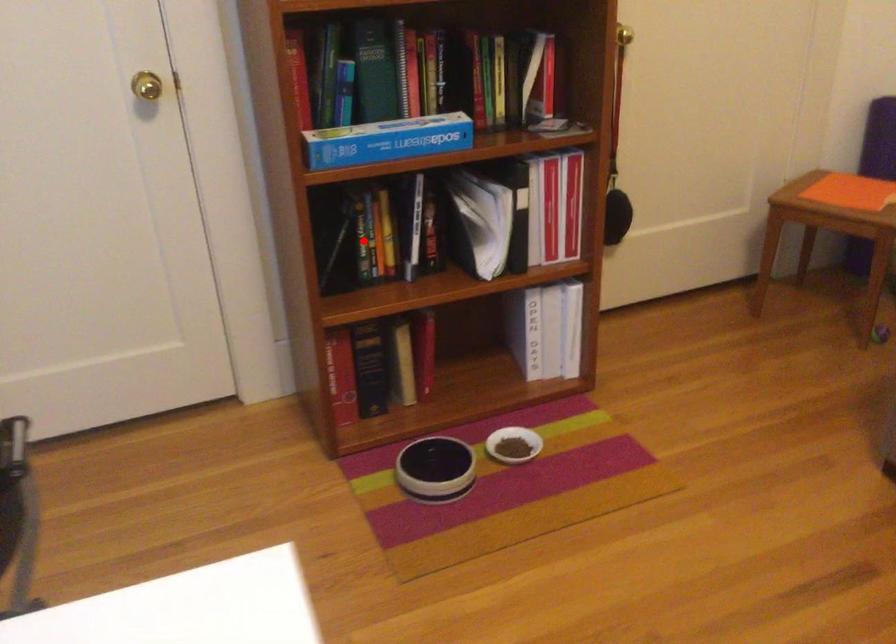
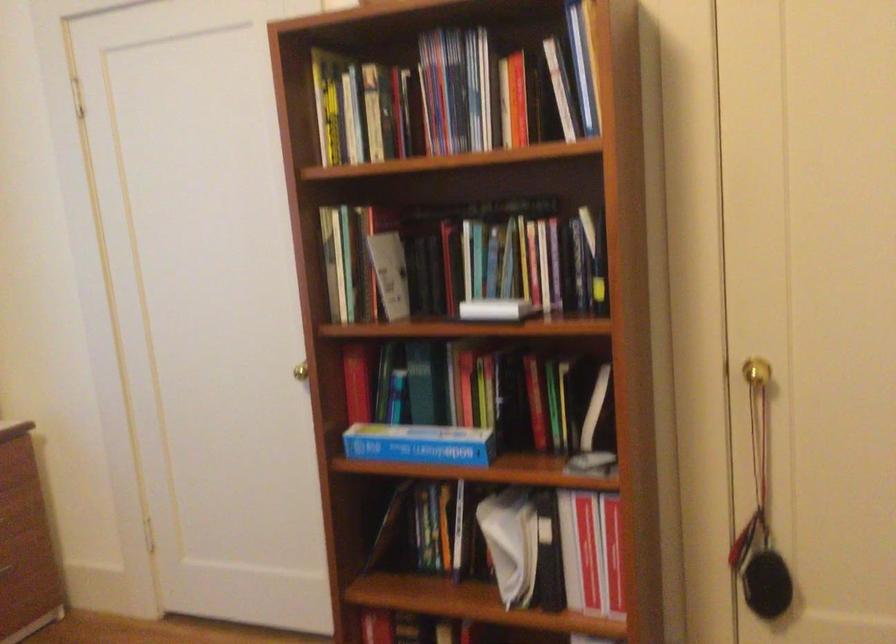
Where in the second image is the point corresponding to the highlighted location from the first image?

(426, 527)